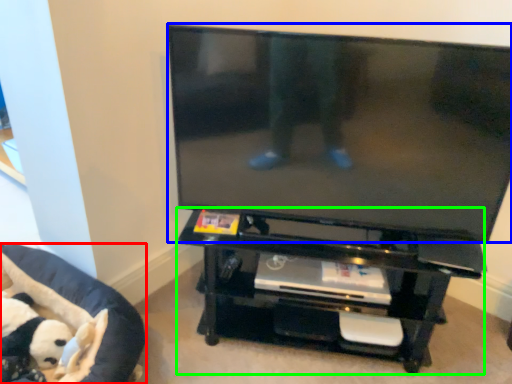
Question: Which object is positioned farthest from furniture (highlighted by a red box)? Select from television (highlighted by a blue box) and entertainment center (highlighted by a green box).

Choices:
 (A) television
 (B) entertainment center

Answer: (A)